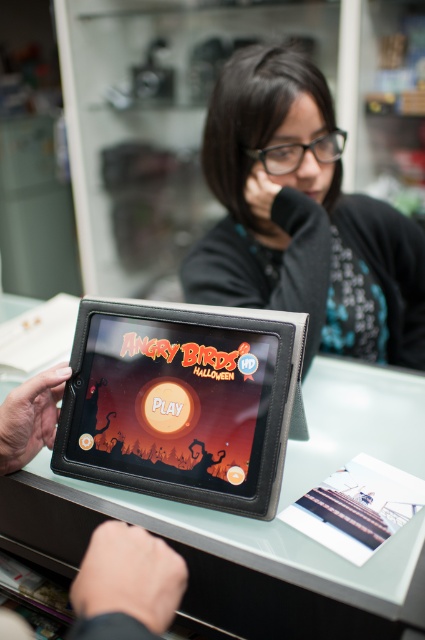
Question: Does black matte jacket at upper center have a larger size compared to black leather tablet at center?

Choices:
 (A) yes
 (B) no

Answer: (A)

Question: Is black matte jacket at upper center smaller than black leather tablet at center?

Choices:
 (A) yes
 (B) no

Answer: (B)

Question: Which object appears closest to the camera in this image?

Choices:
 (A) black leather tablet at center
 (B) black matte jacket at upper center

Answer: (A)

Question: Is black matte jacket at upper center thinner than black leather tablet at center?

Choices:
 (A) no
 (B) yes

Answer: (A)

Question: Which of the following is the farthest from the observer?

Choices:
 (A) (385, 212)
 (B) (130, 472)

Answer: (A)